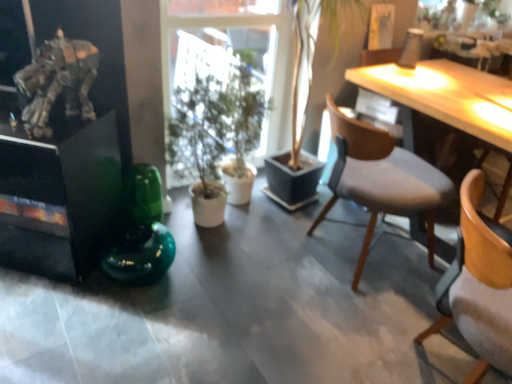
Question: Is light wood desk at upper right inside the boundaries of green matte plant at center, or outside?

Choices:
 (A) inside
 (B) outside

Answer: (B)

Question: Would you say light wood desk at upper right is to the left or to the right of green matte plant at center in the picture?

Choices:
 (A) right
 (B) left

Answer: (A)

Question: Considering the real-world distances, which object is farthest from the light wood desk at upper right?

Choices:
 (A) wooden chair at right, positioned as the second chair in back-to-front order
 (B) green matte plant at center
 (C) green glass vase at center
 (D) metallic silver robot at upper left
 (E) wooden chair with grey cushion at right, which ranks as the 2th chair in front-to-back order

Answer: (D)

Question: Estimate the real-world distances between objects in this image. Which object is closer to the wooden chair at right, positioned as the second chair in back-to-front order?

Choices:
 (A) metallic silver robot at upper left
 (B) green matte plant at center
 (C) wooden chair with grey cushion at right, positioned as the first chair in back-to-front order
 (D) green glass vase at center
 (E) light wood desk at upper right

Answer: (C)